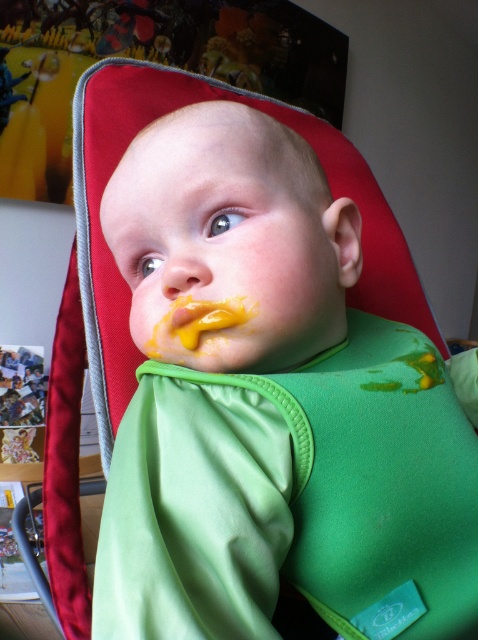
Question: Which of these objects is positioned closest to the green soft bib at center?

Choices:
 (A) yellow smooth paste at center
 (B) yellow matte nose at center

Answer: (A)

Question: Can you confirm if yellow smooth paste at center is positioned to the right of yellow matte nose at center?

Choices:
 (A) yes
 (B) no

Answer: (A)

Question: Is green soft bib at center behind yellow matte nose at center?

Choices:
 (A) yes
 (B) no

Answer: (B)

Question: Estimate the real-world distances between objects in this image. Which object is farther from the yellow smooth paste at center?

Choices:
 (A) yellow matte nose at center
 (B) green soft bib at center

Answer: (B)

Question: Is green soft bib at center smaller than yellow matte nose at center?

Choices:
 (A) yes
 (B) no

Answer: (B)

Question: Among these objects, which one is nearest to the camera?

Choices:
 (A) yellow matte nose at center
 (B) yellow smooth paste at center

Answer: (A)